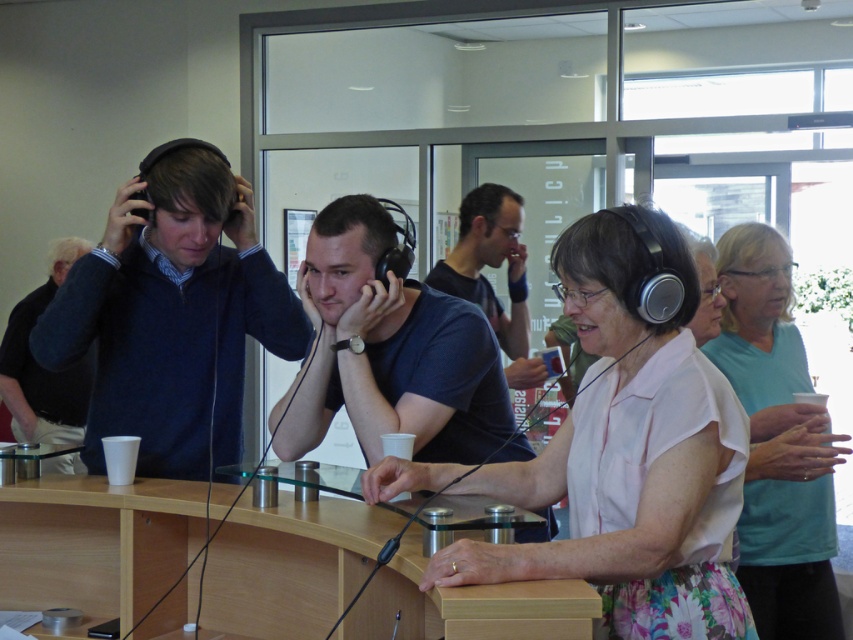
You are organizing a photo shoot and need to arrange the models according to their clothing. If you want to place the white floral dress at center to the left of the dark blue sweater at left, is that possible based on their current positions?

The white floral dress at center is currently positioned on the right side of the dark blue sweater at left. To place the white floral dress at center to the left of the dark blue sweater at left, they would need to swap positions since the white floral dress is currently to the right.

You are standing in the room and want to hand a note to the person wearing the matte blue sweater at left. Based on their position in the image, which direction should you walk to reach them?

The matte blue sweater at left is located at point (172, 314), so you should walk towards the left side of the room to reach them.